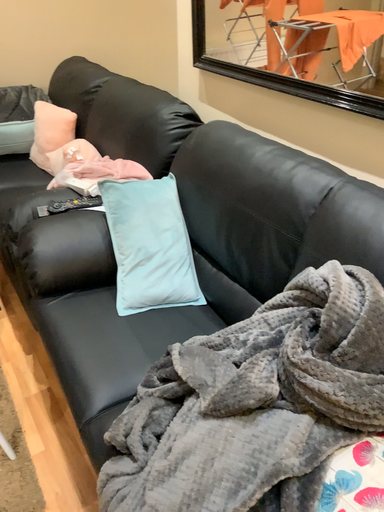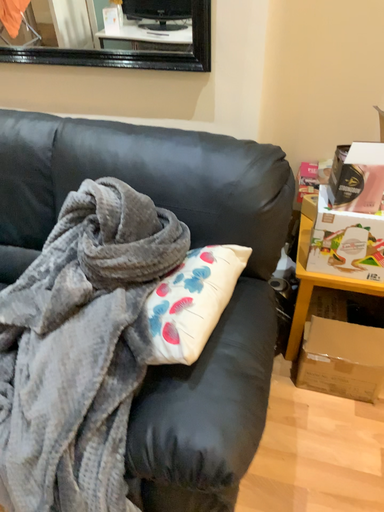
Question: Which way did the camera rotate in the video?

Choices:
 (A) rotated right
 (B) rotated left

Answer: (A)